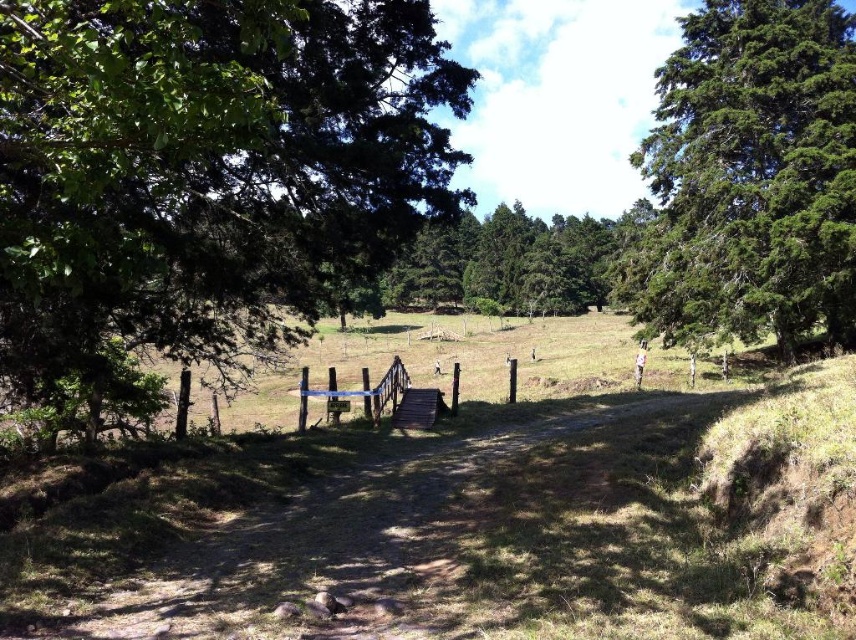
Question: Which of the following is the closest to the observer?

Choices:
 (A) (714, 124)
 (B) (191, 298)
 (C) (305, 548)

Answer: (C)

Question: In this image, where is green leafy tree at left located relative to green textured tree at right?

Choices:
 (A) above
 (B) below

Answer: (B)

Question: From the image, what is the correct spatial relationship of green leafy tree at left in relation to green textured tree at right?

Choices:
 (A) above
 (B) below

Answer: (B)

Question: Can you confirm if dirt path at center is positioned to the left of green textured tree at right?

Choices:
 (A) yes
 (B) no

Answer: (A)

Question: Which point is closer to the camera?

Choices:
 (A) dirt path at center
 (B) green leafy tree at left
 (C) green textured tree at right

Answer: (B)

Question: Among these points, which one is nearest to the camera?

Choices:
 (A) (556, 436)
 (B) (111, 19)

Answer: (B)